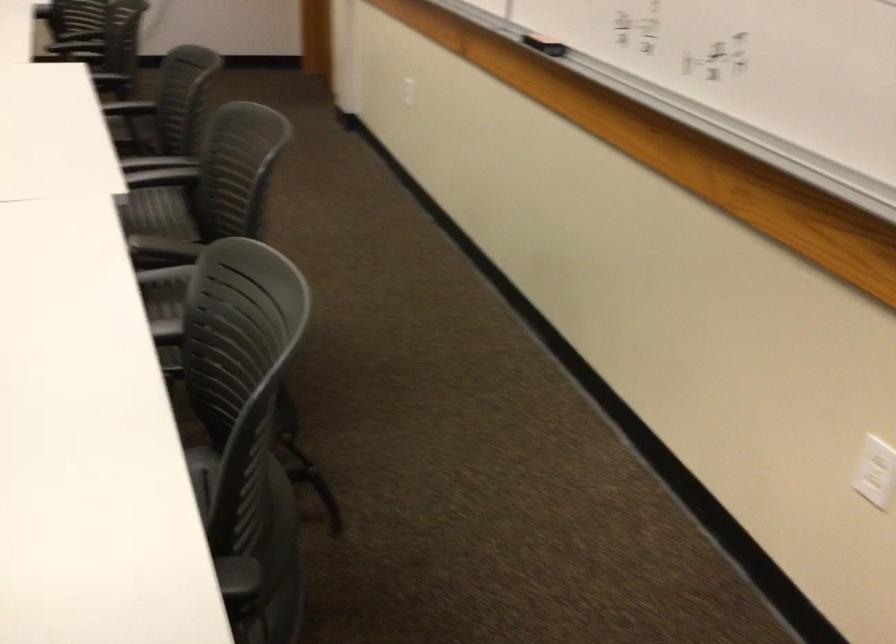
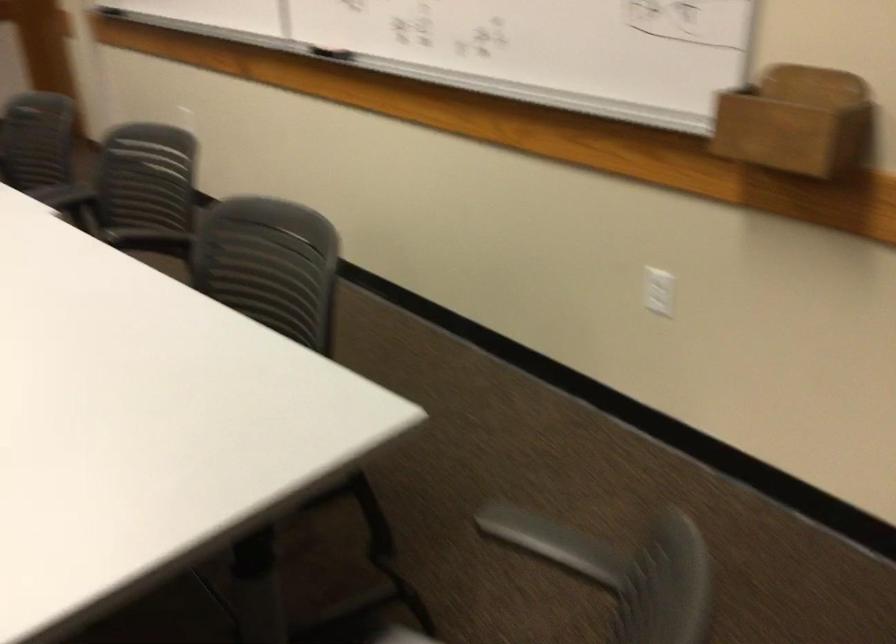
The point at (245,166) is marked in the first image. Where is the corresponding point in the second image?

(144, 178)